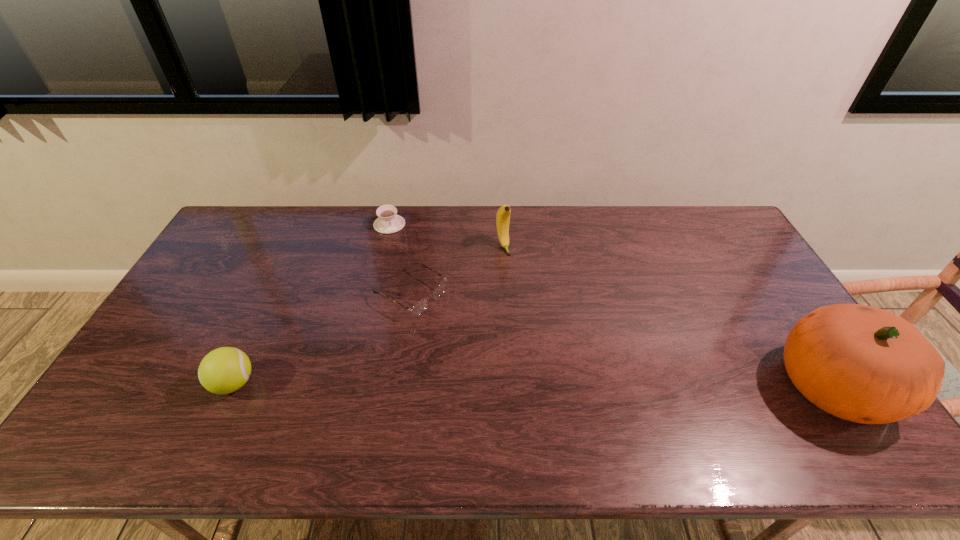
At what (x,y) coordinates should I click in order to perform the action: click on object that can be found as the third closest to the pumpkin. Please return your answer as a coordinate pair (x, y). Looking at the image, I should click on (388, 222).

Where is `object that stands as the closest to the fourth shortest object`? This screenshot has width=960, height=540. object that stands as the closest to the fourth shortest object is located at coordinates (418, 308).

The width and height of the screenshot is (960, 540). Find the location of `free space that satisfies the following two spatial constraints: 1. on the front side of the pumpkin; 2. on the face of the teacup`. free space that satisfies the following two spatial constraints: 1. on the front side of the pumpkin; 2. on the face of the teacup is located at coordinates (350, 386).

Identify the location of vacant area in the image that satisfies the following two spatial constraints: 1. on the front side of the pumpkin; 2. on the face of the third tallest object. 233,386.

In order to click on vacant region that satisfies the following two spatial constraints: 1. on the front side of the teacup; 2. on the face of the rightmost object in this screenshot , I will do click(350, 386).

The image size is (960, 540). Identify the location of vacant area in the image that satisfies the following two spatial constraints: 1. on the front side of the farthest object; 2. on the face of the rightmost object. (350, 386).